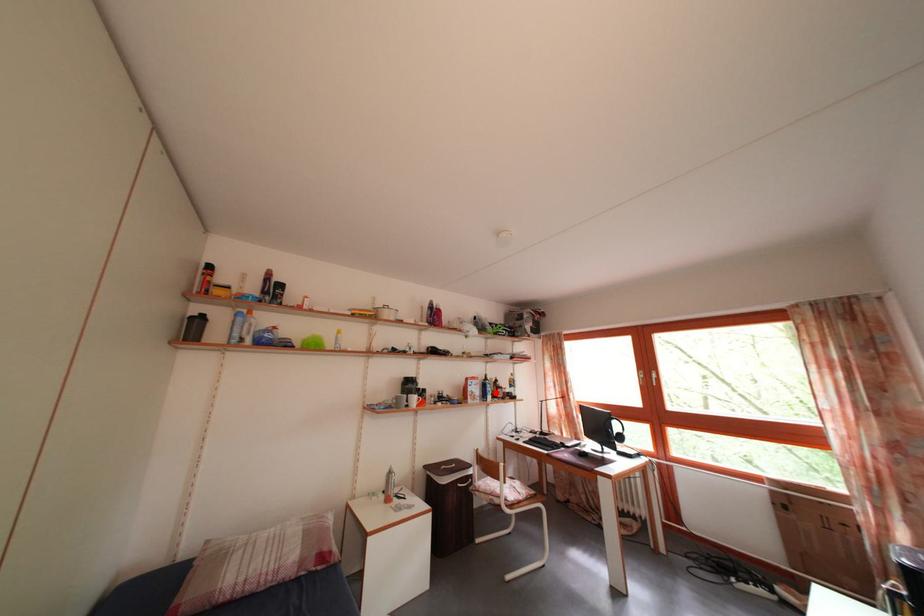
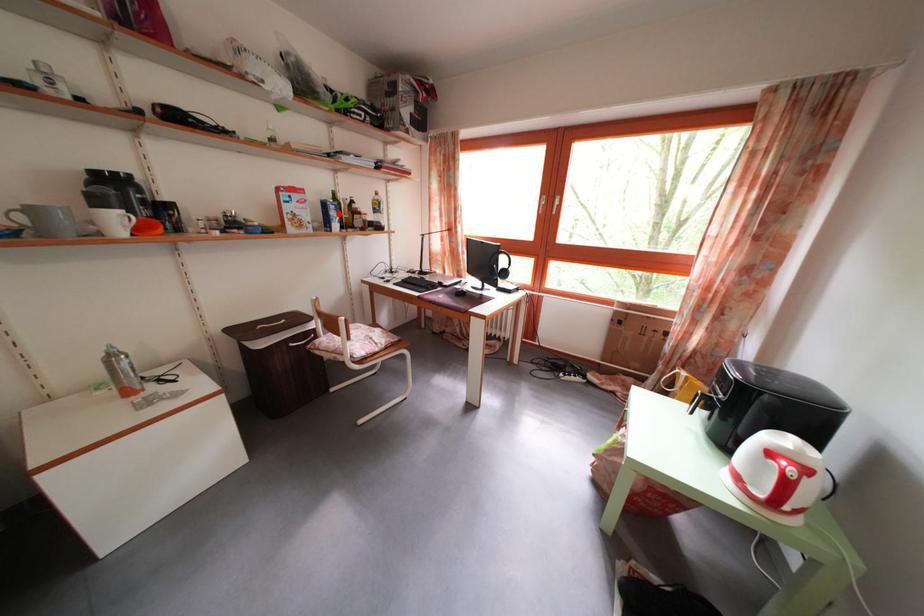
I am providing you with two images of the same scene from different viewpoints. A red point is marked on the first image and another point is marked on the second image. Are the points marked in image1 and image2 representing the same 3D position?

Yes